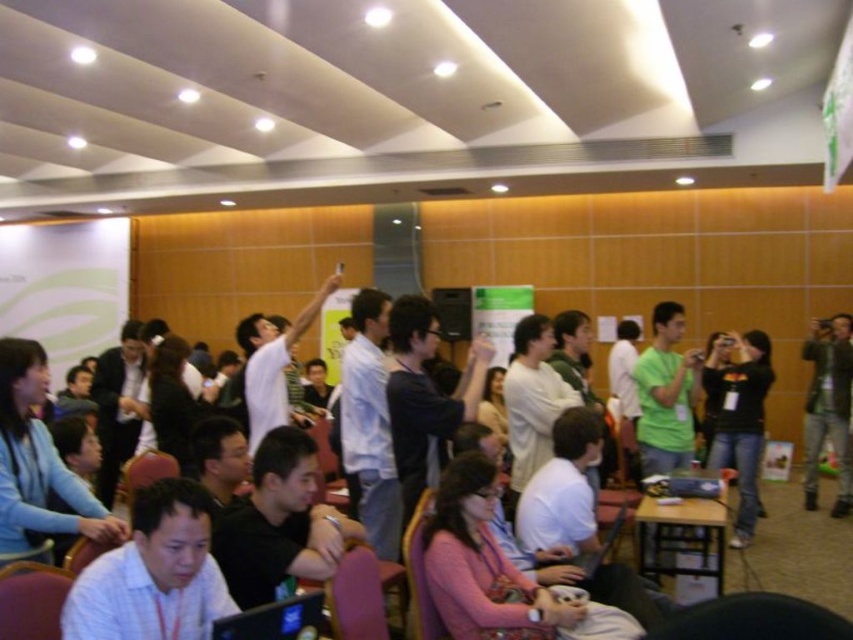
Does black cotton shirt at center come behind green leather jacket at right?

No, black cotton shirt at center is closer to the viewer.

Is point (718, 433) positioned in front of point (822, 369)?

Yes.

Locate an element on the screen. The height and width of the screenshot is (640, 853). black cotton shirt at center is located at coordinates (740, 419).